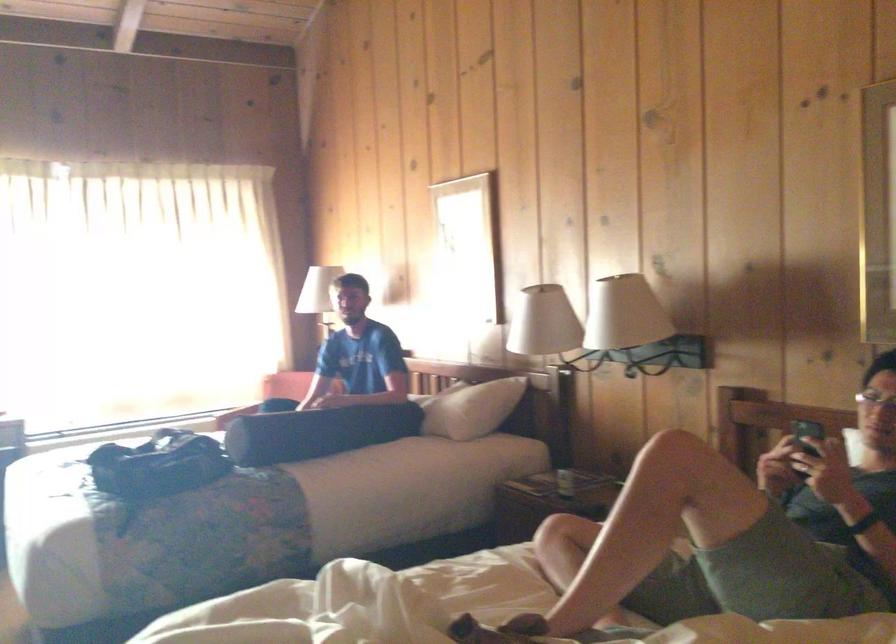
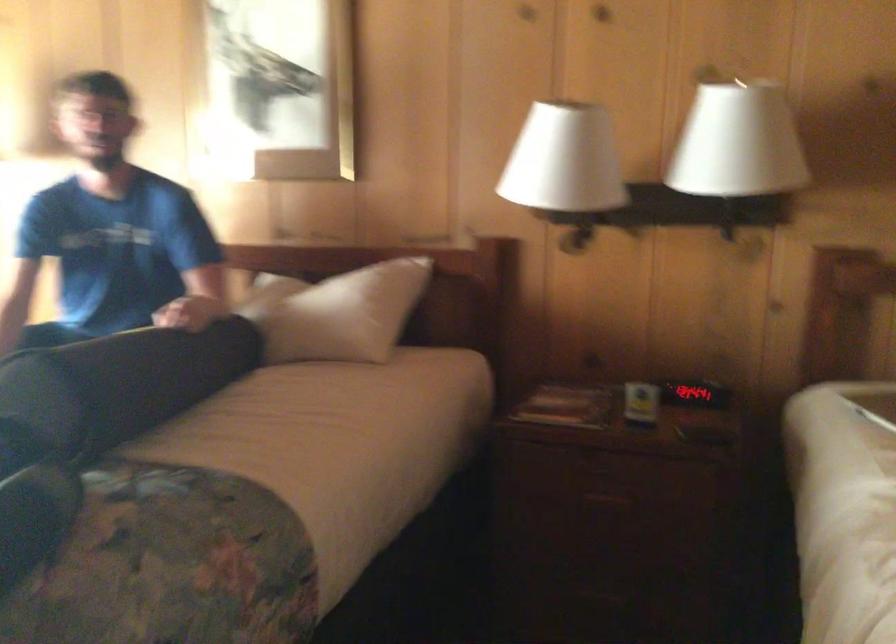
Find the pixel in the second image that matches point 226,505 in the first image.

(170, 565)